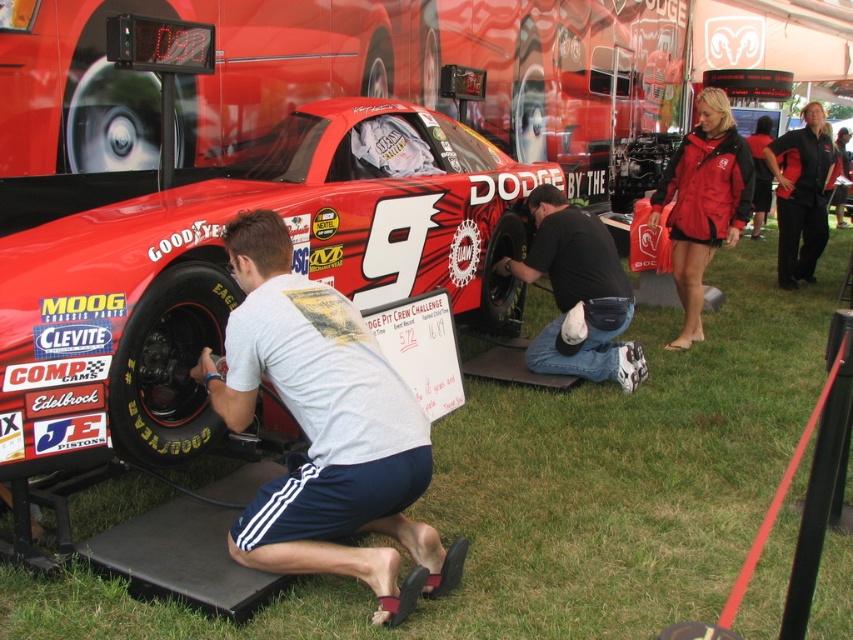
Question: Which object appears closest to the camera in this image?

Choices:
 (A) red matte jacket at upper right
 (B) black fabric jacket at upper right

Answer: (A)

Question: Is white fabric shirt at lower left closer to camera compared to black fabric jacket at upper right?

Choices:
 (A) no
 (B) yes

Answer: (B)

Question: Which object appears closest to the camera in this image?

Choices:
 (A) white fabric shirt at lower left
 (B) black rubber tire at lower left
 (C) shiny red car at center

Answer: (A)

Question: Which object is closer to the camera taking this photo?

Choices:
 (A) shiny red car at center
 (B) black rubber tire at lower center
 (C) red matte jacket at upper right

Answer: (A)

Question: Considering the relative positions of black fabric pants at lower center and black fabric jacket at upper right in the image provided, where is black fabric pants at lower center located with respect to black fabric jacket at upper right?

Choices:
 (A) left
 (B) right

Answer: (A)

Question: Can you confirm if black rubber tire at lower left is positioned to the left of black rubber tire at lower center?

Choices:
 (A) yes
 (B) no

Answer: (A)